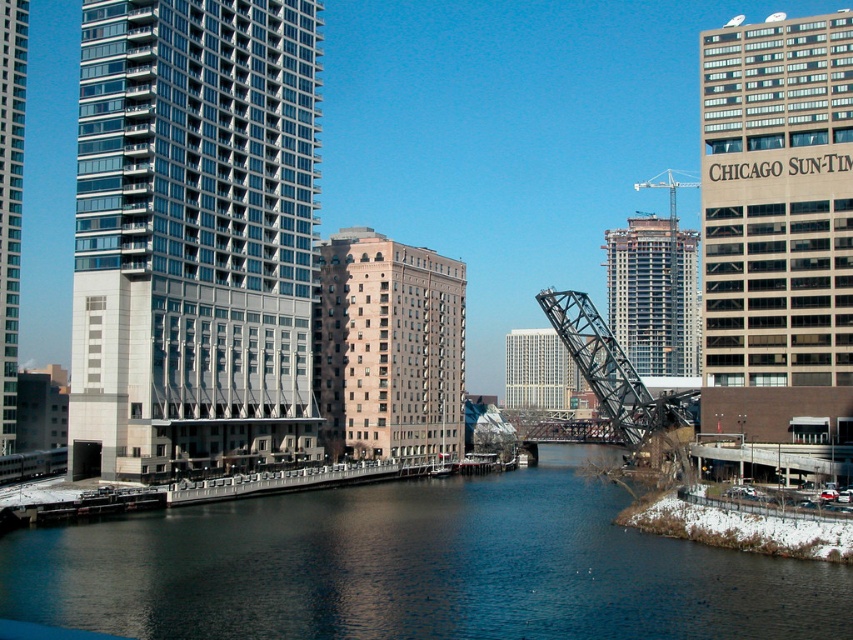
Question: Considering the real-world distances, which object is closest to the glassy reflective skyscraper at left?

Choices:
 (A) white glass building at center
 (B) beige glass building at upper right
 (C) brown brick building at center

Answer: (C)

Question: Does dark blue water at center have a smaller size compared to white glass building at center?

Choices:
 (A) yes
 (B) no

Answer: (A)

Question: Which object is farther from the camera taking this photo?

Choices:
 (A) brown brick building at center
 (B) glassy concrete skyscraper at left
 (C) dark blue water at center

Answer: (A)

Question: Among these objects, which one is nearest to the camera?

Choices:
 (A) beige glass building at upper right
 (B) dark blue water at center

Answer: (B)

Question: Is the position of gray concrete building at center more distant than that of glassy reflective skyscraper at left?

Choices:
 (A) yes
 (B) no

Answer: (A)

Question: Can you confirm if beige glass building at upper right is positioned above gray concrete building at center?

Choices:
 (A) yes
 (B) no

Answer: (B)